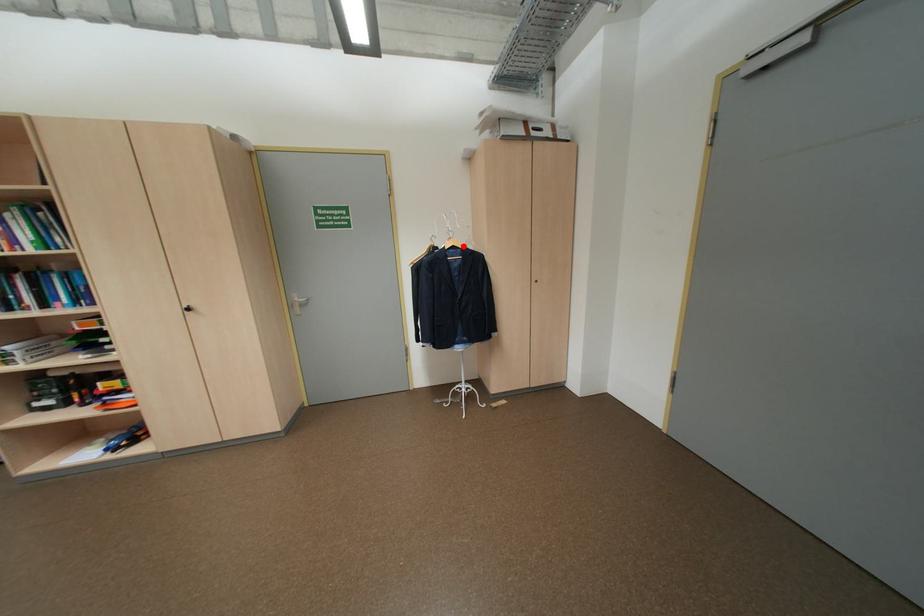
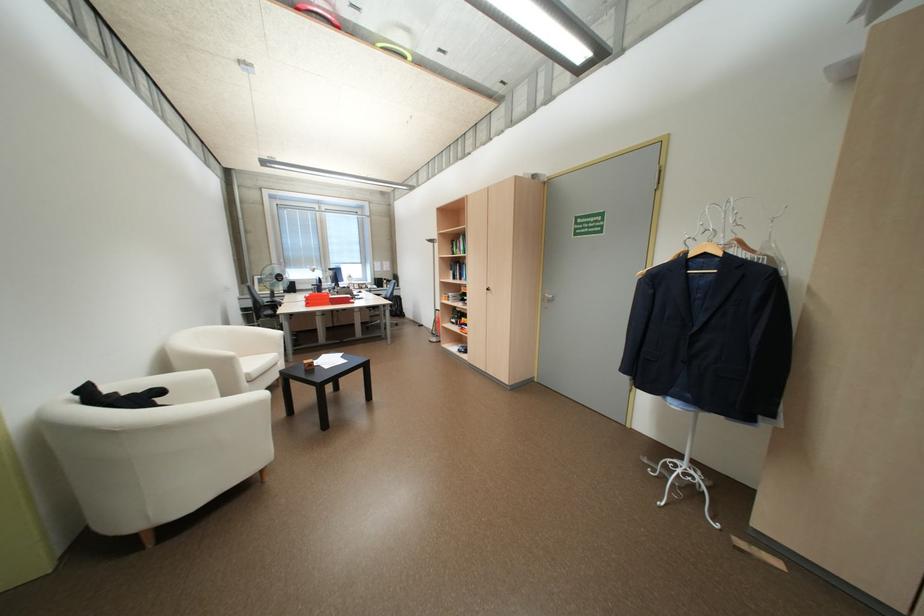
The point at the highlighted location is marked in the first image. Where is the corresponding point in the second image?

(714, 254)